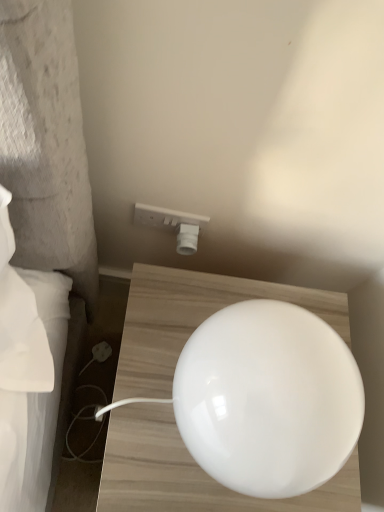
Question: Is white glossy lampshade at center outside white plastic electrical outlet at upper center?

Choices:
 (A) yes
 (B) no

Answer: (A)

Question: Are white glossy lampshade at center and white plastic electrical outlet at upper center beside each other?

Choices:
 (A) yes
 (B) no

Answer: (B)

Question: From a real-world perspective, is white glossy lampshade at center located beneath white plastic electrical outlet at upper center?

Choices:
 (A) no
 (B) yes

Answer: (A)

Question: Does white glossy lampshade at center have a greater width compared to white plastic electrical outlet at upper center?

Choices:
 (A) no
 (B) yes

Answer: (B)

Question: Can you confirm if white glossy lampshade at center is taller than white plastic electrical outlet at upper center?

Choices:
 (A) no
 (B) yes

Answer: (B)

Question: Is white glossy lampshade at center at the right side of white plastic electrical outlet at upper center?

Choices:
 (A) no
 (B) yes

Answer: (B)

Question: Can you confirm if white plastic electrical outlet at upper center is taller than white glossy lampshade at center?

Choices:
 (A) yes
 (B) no

Answer: (B)

Question: Could you tell me if white plastic electrical outlet at upper center is turned towards white glossy lampshade at center?

Choices:
 (A) yes
 (B) no

Answer: (B)

Question: From a real-world perspective, is white plastic electrical outlet at upper center physically below white glossy lampshade at center?

Choices:
 (A) no
 (B) yes

Answer: (B)

Question: Is white plastic electrical outlet at upper center oriented away from white glossy lampshade at center?

Choices:
 (A) yes
 (B) no

Answer: (B)

Question: Is white plastic electrical outlet at upper center thinner than white glossy lampshade at center?

Choices:
 (A) no
 (B) yes

Answer: (B)

Question: Is white glossy lampshade at center surrounded by white plastic electrical outlet at upper center?

Choices:
 (A) yes
 (B) no

Answer: (B)

Question: Is point (182, 248) closer or farther from the camera than point (198, 350)?

Choices:
 (A) closer
 (B) farther

Answer: (B)